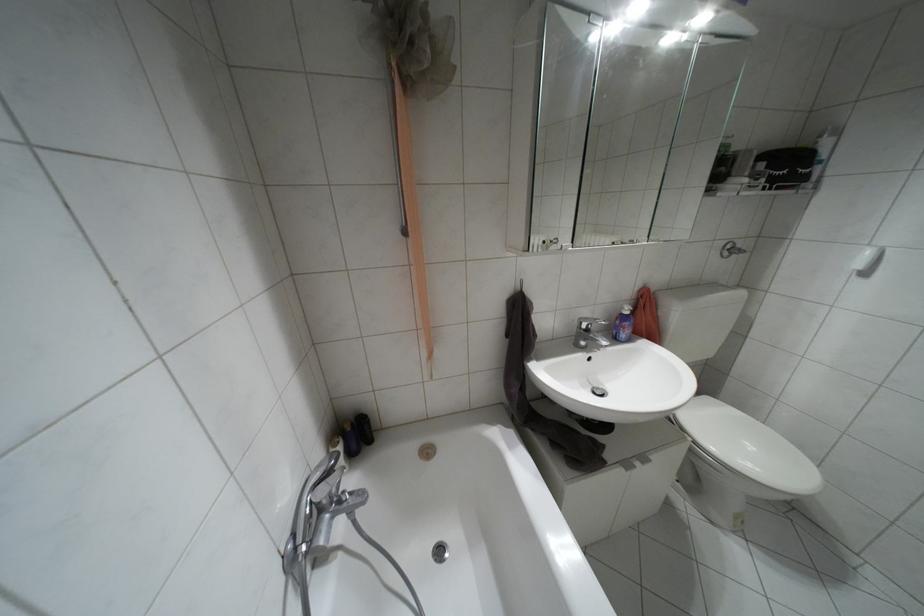
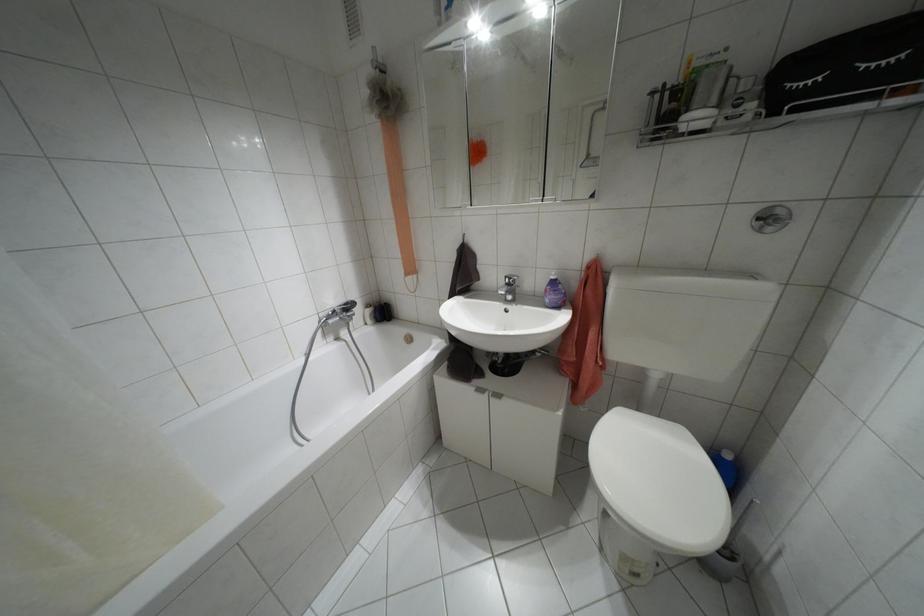
Locate, in the second image, the point that corresponds to [587,330] in the first image.

(507, 284)